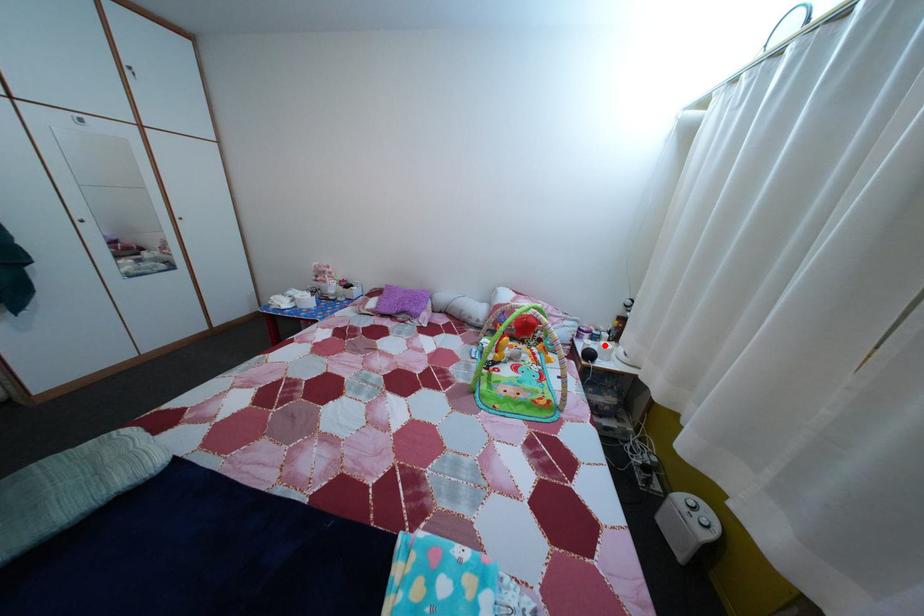
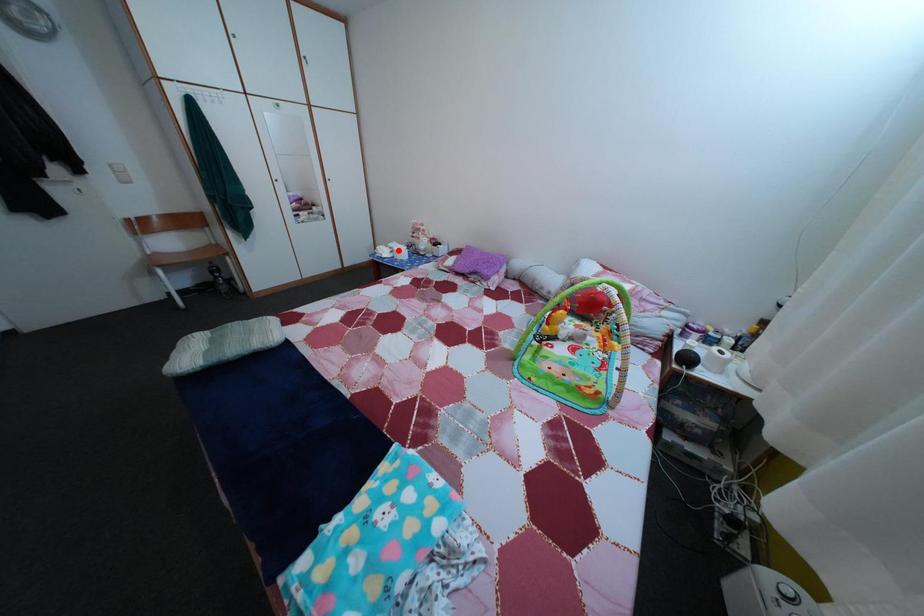
I am providing you with two images of the same scene from different viewpoints. A red point is marked on the first image and another point is marked on the second image. Are the points marked in image1 and image2 representing the same 3D position?

No